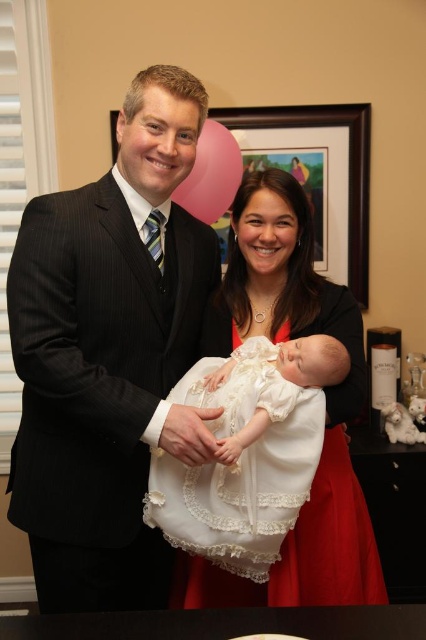
Which is in front, point (239, 406) or point (368, 291)?

Point (239, 406) is more forward.

Describe the element at coordinates (241, 465) in the screenshot. I see `white lace dress at center` at that location.

Does point (181, 492) lie behind point (270, 112)?

No, it is in front of (270, 112).

At what (x,y) coordinates should I click in order to perform the action: click on white lace dress at center. Please return your answer as a coordinate pair (x, y). Image resolution: width=426 pixels, height=640 pixels. Looking at the image, I should click on (241, 465).

Is point (98, 518) positioned before point (298, 273)?

Yes, point (98, 518) is closer to viewer.

You are a GUI agent. You are given a task and a screenshot of the screen. Output one action in this format:
    pyautogui.click(x=<x>, y=<y>)
    Task: Click on the black pinstripe suit at left
    
    Given the screenshot: What is the action you would take?
    pyautogui.click(x=109, y=355)

The width and height of the screenshot is (426, 640). In order to click on black pinstripe suit at left in this screenshot , I will do `click(109, 355)`.

This screenshot has width=426, height=640. What do you see at coordinates (109, 355) in the screenshot?
I see `black pinstripe suit at left` at bounding box center [109, 355].

Locate an element on the screen. The width and height of the screenshot is (426, 640). black pinstripe suit at left is located at coordinates (109, 355).